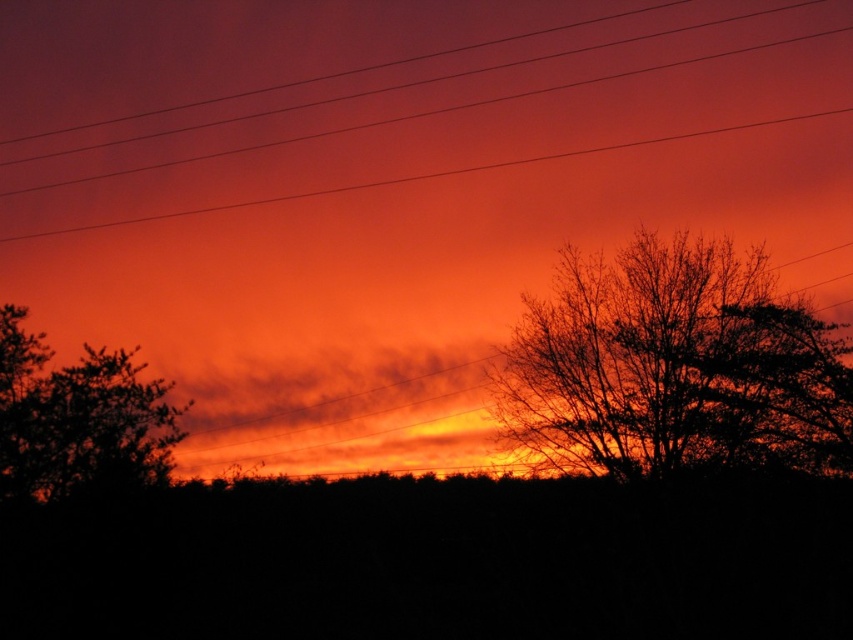
Does silhouette tree at left appear over smooth wire at upper center?

Incorrect, silhouette tree at left is not positioned above smooth wire at upper center.

Which of these two, silhouette tree at left or smooth wire at upper center, stands shorter?

With less height is silhouette tree at left.

This screenshot has height=640, width=853. I want to click on silhouette tree at left, so click(77, 419).

Who is more forward, (x=712, y=460) or (x=109, y=352)?

Point (x=712, y=460)

Can you confirm if silhouette tree at right is taller than silhouette tree at left?

Yes, silhouette tree at right is taller than silhouette tree at left.

Image resolution: width=853 pixels, height=640 pixels. What do you see at coordinates (674, 365) in the screenshot? I see `silhouette tree at right` at bounding box center [674, 365].

What are the coordinates of `silhouette tree at right` in the screenshot? It's located at (674, 365).

Is point (570, 452) farther from camera compared to point (201, 124)?

Yes, point (570, 452) is behind point (201, 124).

Between silhouette tree at right and smooth wire at upper center, which one has less height?

Standing shorter between the two is silhouette tree at right.

Who is more forward, (607,332) or (7,196)?

Point (7,196) is more forward.

The image size is (853, 640). I want to click on silhouette tree at right, so click(674, 365).